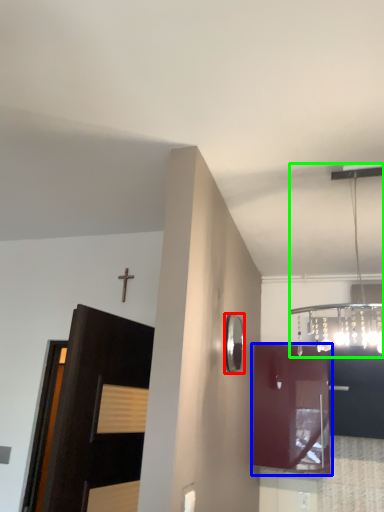
Question: Which object is the closest to the mirror (highlighted by a red box)? Choose among these: cabinetry (highlighted by a blue box) or light fixture (highlighted by a green box).

Choices:
 (A) cabinetry
 (B) light fixture

Answer: (B)